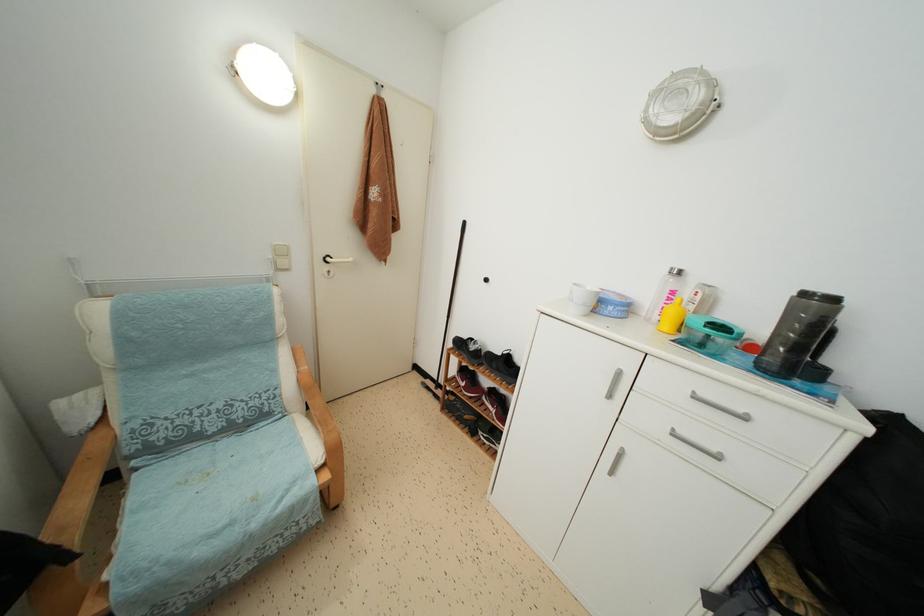
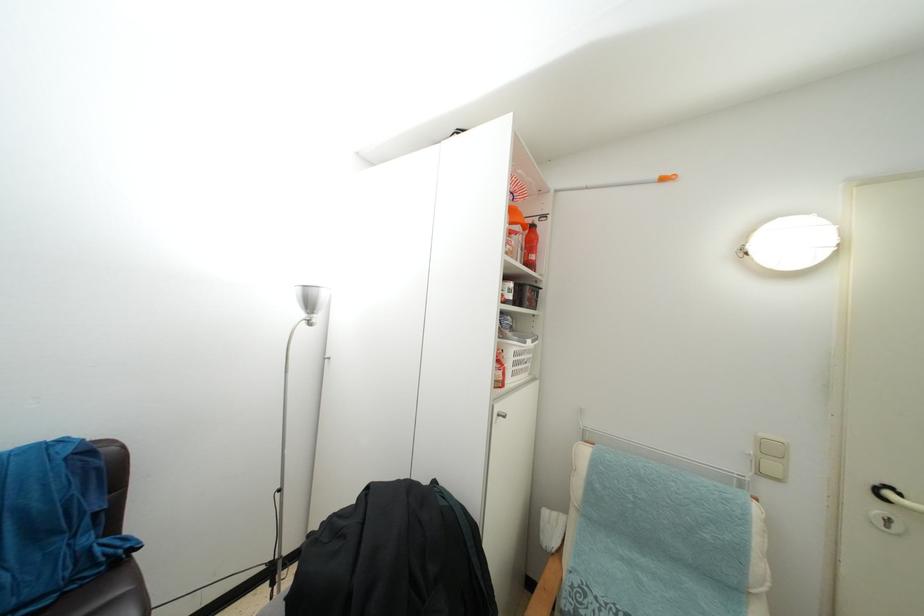
Question: The first image is from the beginning of the video and the second image is from the end. How did the camera likely rotate when shooting the video?

Choices:
 (A) Left
 (B) Right
 (C) Up
 (D) Down

Answer: (A)